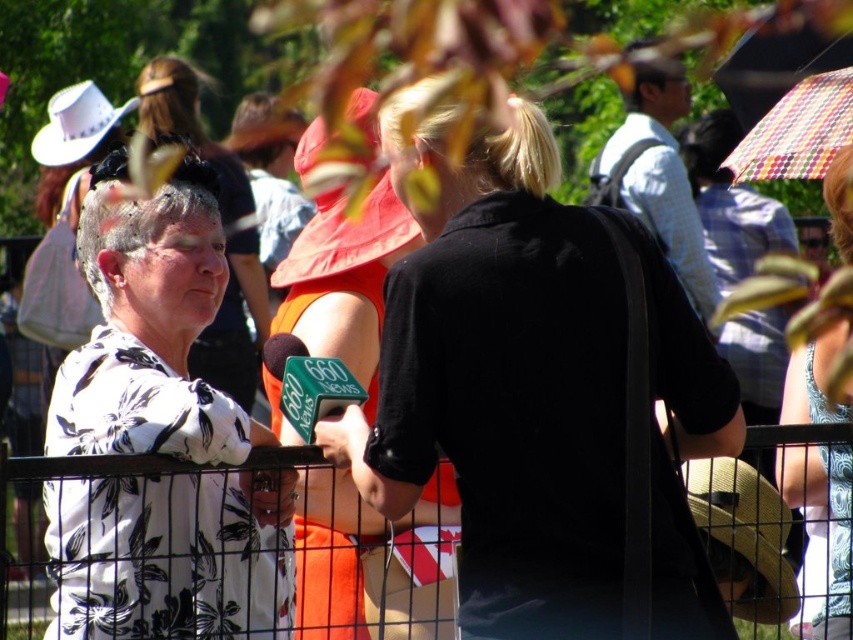
Between black matte shirt at center and white felt cowboy hat at upper left, which one has less height?

With less height is white felt cowboy hat at upper left.

Measure the distance between black matte shirt at center and camera.

The distance of black matte shirt at center from camera is 39.17 feet.

You are a GUI agent. You are given a task and a screenshot of the screen. Output one action in this format:
    pyautogui.click(x=<x>, y=<y>)
    Task: Click on the black matte shirt at center
    
    Given the screenshot: What is the action you would take?
    pyautogui.click(x=503, y=380)

Does white floral shirt at left have a larger size compared to brown straw cowboy hat at lower right?

Indeed, white floral shirt at left has a larger size compared to brown straw cowboy hat at lower right.

Between white floral shirt at left and brown straw cowboy hat at lower right, which one is positioned lower?

brown straw cowboy hat at lower right is below.

Is point (125, 582) behind point (747, 525)?

No.

Locate an element on the screen. The image size is (853, 640). white floral shirt at left is located at coordinates (149, 326).

Does brown straw cowboy hat at lower right have a greater height compared to black metal fence at center?

Incorrect, brown straw cowboy hat at lower right's height is not larger of black metal fence at center's.

Can you confirm if brown straw cowboy hat at lower right is bigger than black metal fence at center?

No.

Who is more distant from viewer, (724, 472) or (26, 468)?

The point (724, 472) is more distant.

This screenshot has height=640, width=853. What are the coordinates of `brown straw cowboy hat at lower right` in the screenshot? It's located at (743, 538).